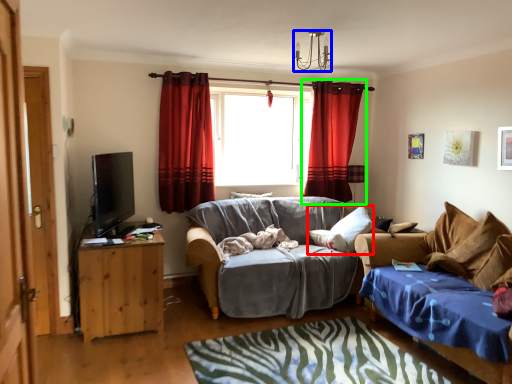
Question: Estimate the real-world distances between objects in this image. Which object is closer to pillow (highlighted by a red box), lamp (highlighted by a blue box) or curtain (highlighted by a green box)?

Choices:
 (A) lamp
 (B) curtain

Answer: (B)